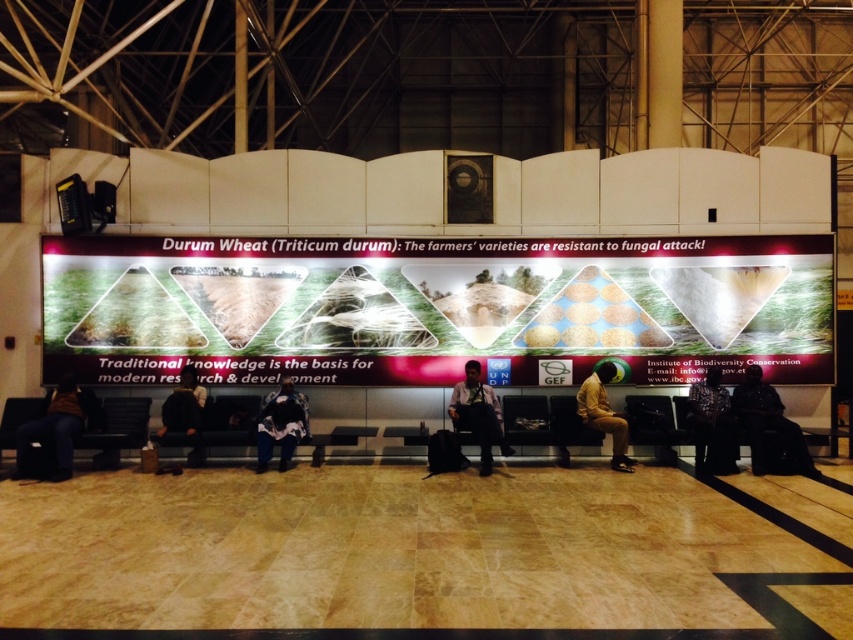
Question: Which object is farther from the camera taking this photo?

Choices:
 (A) dark brown leather jacket at center
 (B) matte pink poster at center
 (C) light blue shirt at center
 (D) brown leather jacket at lower left

Answer: (B)

Question: Among these objects, which one is nearest to the camera?

Choices:
 (A) golden brown suit at lower right
 (B) dark brown leather jacket at lower left

Answer: (B)

Question: Can you confirm if brown leather jacket at lower left is positioned to the left of golden brown suit at lower right?

Choices:
 (A) no
 (B) yes

Answer: (B)

Question: Where is brown leather jacket at lower left located in relation to dark brown leather jacket at lower left in the image?

Choices:
 (A) left
 (B) right

Answer: (A)

Question: Among these points, which one is farthest from the camera?

Choices:
 (A) (108, 417)
 (B) (605, 410)
 (C) (682, 289)

Answer: (C)

Question: Is brown leather jacket at lower left behind black leather bench at lower left?

Choices:
 (A) no
 (B) yes

Answer: (A)